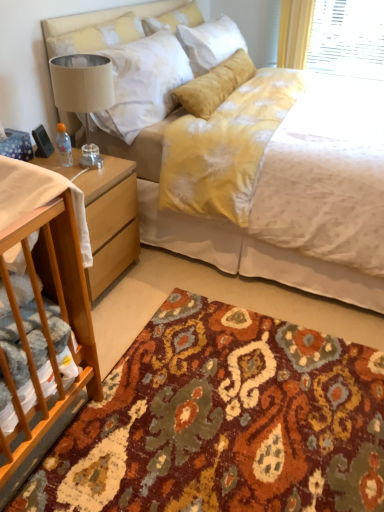
Find the location of a particular element. This screenshot has width=384, height=512. free space above light brown wood nightstand at lower left (from a real-world perspective) is located at coordinates tap(67, 162).